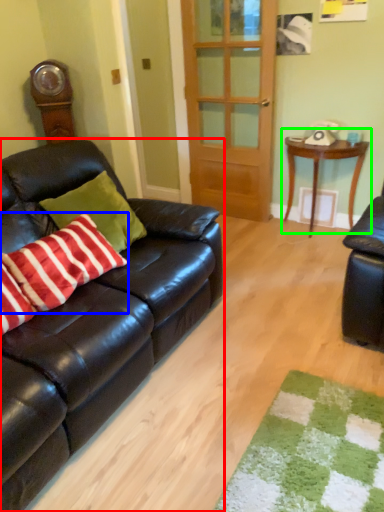
Question: Estimate the real-world distances between objects in this image. Which object is farther from studio couch (highlighted by a red box), pillow (highlighted by a blue box) or table (highlighted by a green box)?

Choices:
 (A) pillow
 (B) table

Answer: (B)